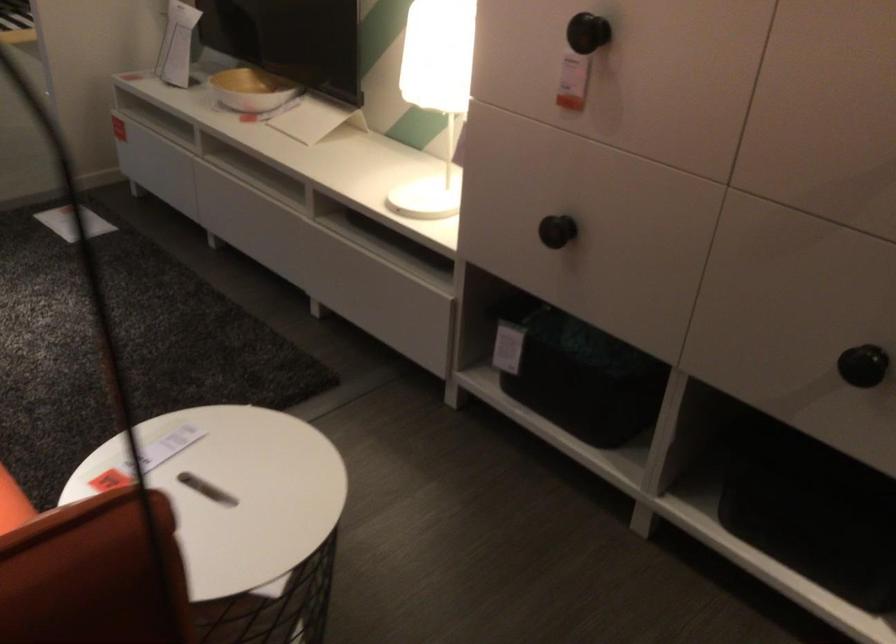
At what (x,y) coordinates should I click in order to perform the action: click on light brown bowl. Please return your answer as a coordinate pair (x, y). The height and width of the screenshot is (644, 896). Looking at the image, I should click on (251, 90).